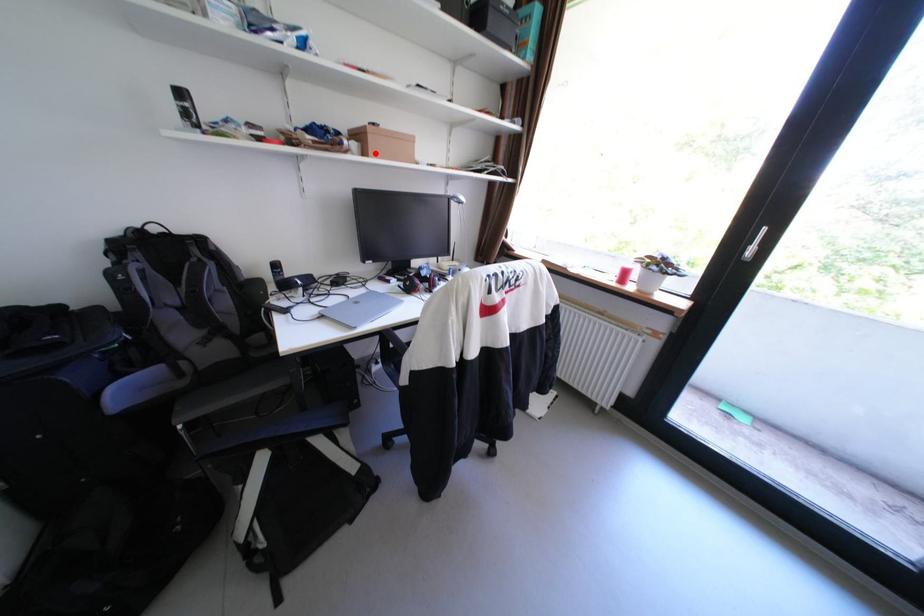
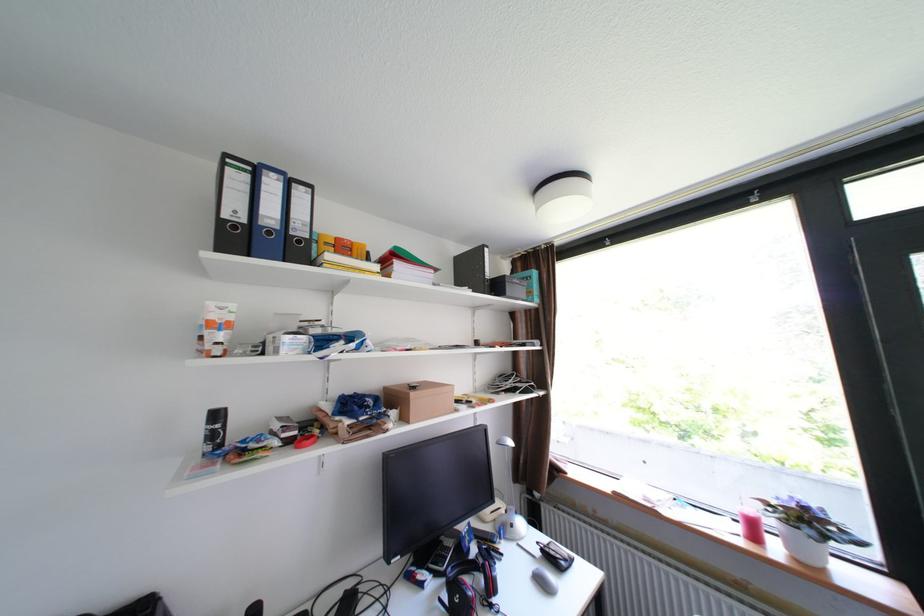
In the second image, find the point that corresponds to the highlighted location in the first image.

(415, 419)